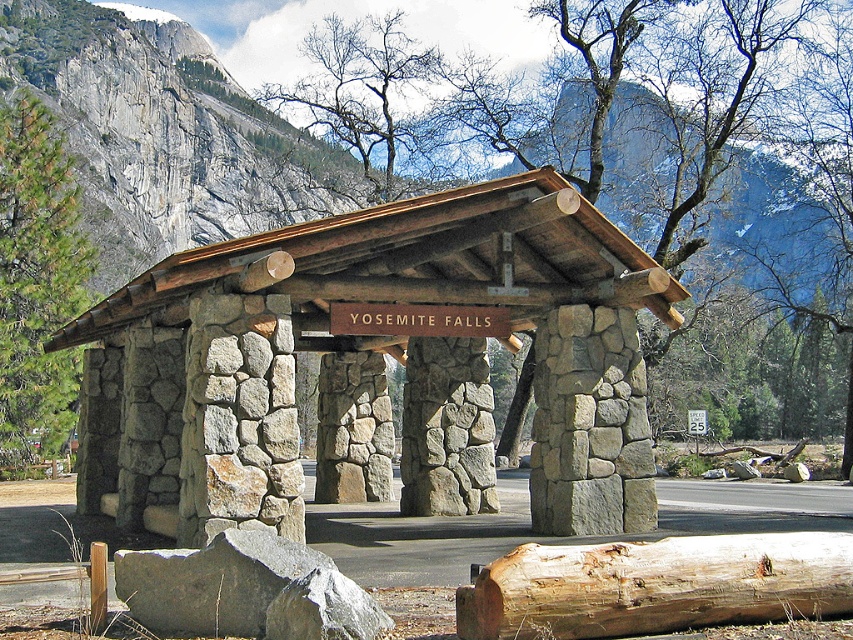
Is green pine tree at left positioned before bare branches at upper center?

Yes, it is.

Does point (38, 131) come closer to viewer compared to point (340, 48)?

Yes, point (38, 131) is closer to viewer.

Image resolution: width=853 pixels, height=640 pixels. I want to click on green pine tree at left, so click(36, 280).

Can you confirm if stone/rough wood hut at center is smaller than bare branches at upper center?

Correct, stone/rough wood hut at center occupies less space than bare branches at upper center.

Is point (640, 458) farther from camera compared to point (379, 29)?

No, (640, 458) is closer to viewer.

Where is `stone/rough wood hut at center`? Image resolution: width=853 pixels, height=640 pixels. stone/rough wood hut at center is located at coordinates (380, 364).

Based on the photo, is the position of stone/rough wood hut at center less distant than that of light brown wood log at center?

That is False.

Does stone/rough wood hut at center come behind light brown wood log at center?

Yes.

Is point (238, 451) closer to viewer compared to point (583, 566)?

No, (238, 451) is further to viewer.

Identify the location of stone/rough wood hut at center. The width and height of the screenshot is (853, 640). (380, 364).